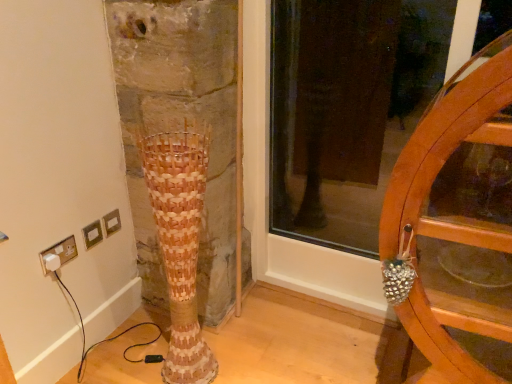
Identify the location of vacant space that is to the left of woven wood vase at center. This screenshot has width=512, height=384. (138, 359).